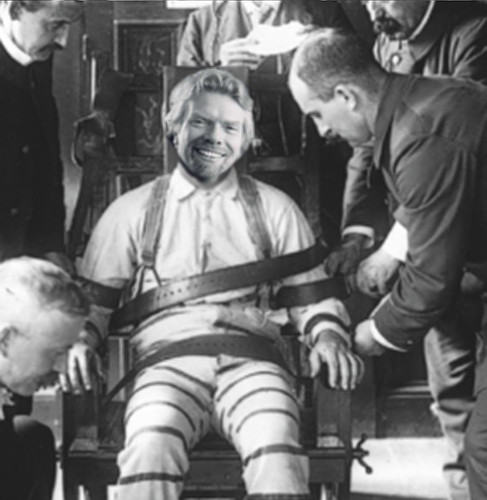
Locate an element on the screen. The height and width of the screenshot is (500, 487). wall is located at coordinates click(386, 406).